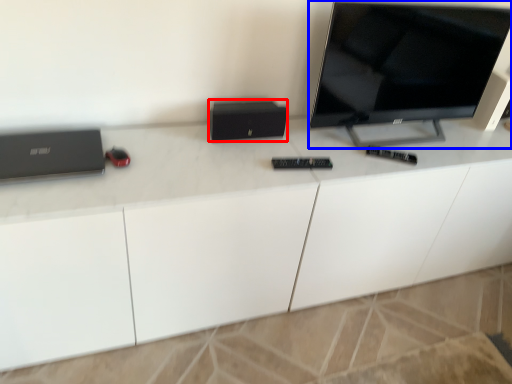
Question: Which of the following is the farthest to the observer, computer (highlighted by a red box) or television (highlighted by a blue box)?

Choices:
 (A) computer
 (B) television

Answer: (A)